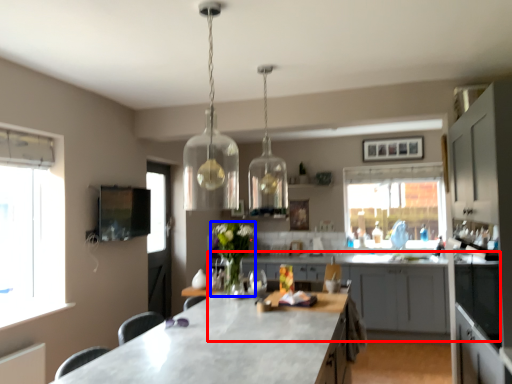
Question: Among these objects, which one is farthest to the camera, cabinetry (highlighted by a red box) or flower (highlighted by a blue box)?

Choices:
 (A) cabinetry
 (B) flower

Answer: (A)